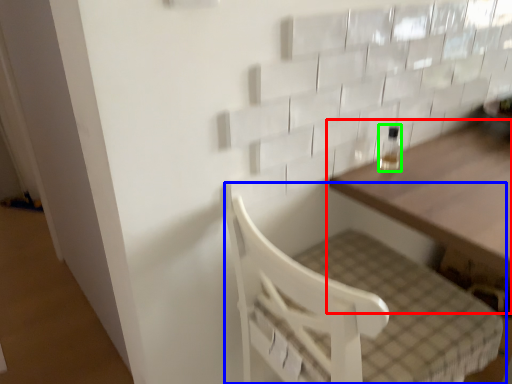
Question: Which object is positioned farthest from table (highlighted by a red box)? Select from furniture (highlighted by a blue box) and bottle (highlighted by a green box).

Choices:
 (A) furniture
 (B) bottle

Answer: (A)